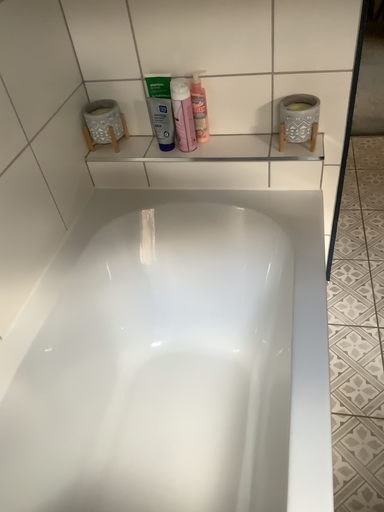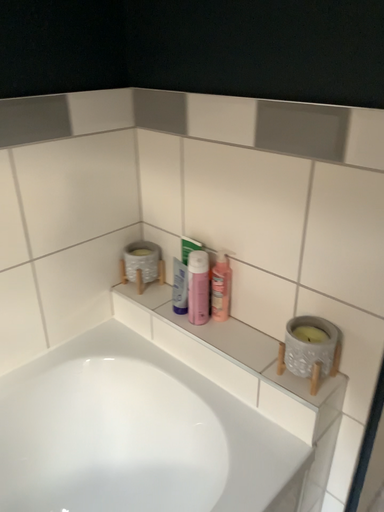
Question: How did the camera likely rotate when shooting the video?

Choices:
 (A) rotated downward
 (B) rotated upward

Answer: (B)